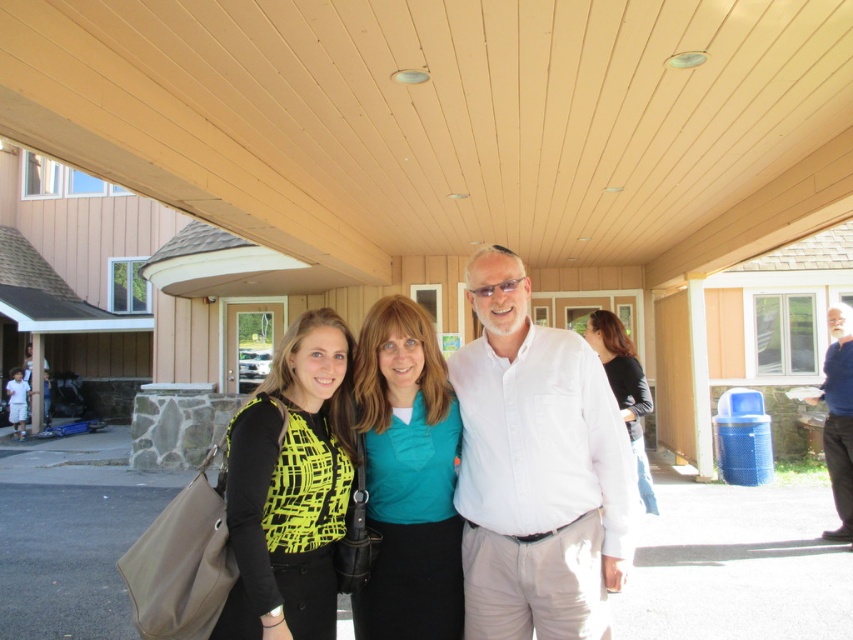
You are standing on the porch and want to hand a gift to the person wearing the neon yellow printed top at center without getting too close to the person with the black jersey at center. Which direction should you approach from?

You should approach from the front of the neon yellow printed top at center since it is closer to the viewer than the black jersey at center, allowing you to reach them without moving closer to the other person.

You are a photographer trying to focus on the neon yellow printed top at center and the black jersey at center. Which one is positioned higher in the image?

The neon yellow printed top at center is positioned higher than the black jersey at center in the image.